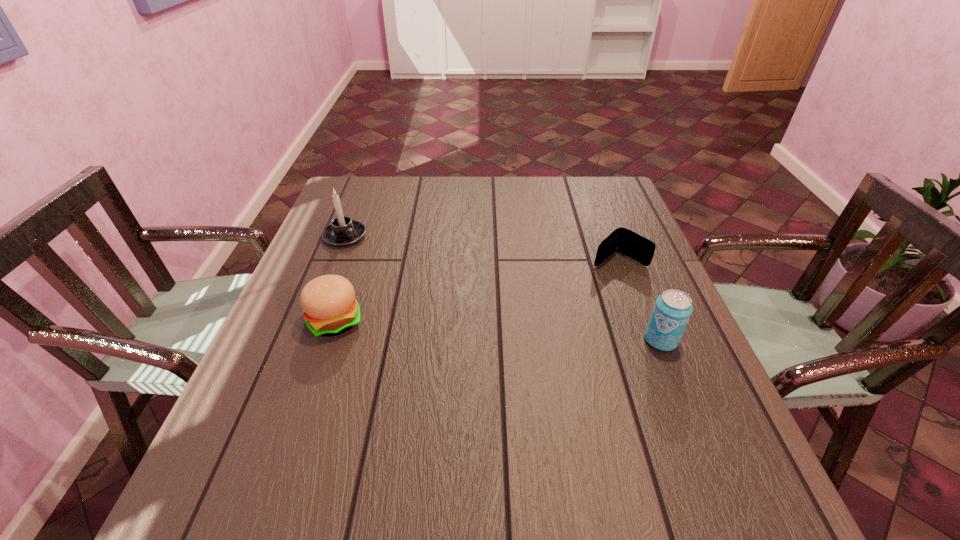
In order to click on unoccupied position between the hamburger and the beer can in this screenshot , I will do `click(498, 330)`.

Where is `free spot between the beer can and the candle holder`? The height and width of the screenshot is (540, 960). free spot between the beer can and the candle holder is located at coordinates (503, 288).

You are a GUI agent. You are given a task and a screenshot of the screen. Output one action in this format:
    pyautogui.click(x=<x>, y=<y>)
    Task: Click on the object that can be found as the third closest to the beer can
    
    Given the screenshot: What is the action you would take?
    pyautogui.click(x=343, y=231)

Identify which object is the third closest to the hamburger. Please provide its 2D coordinates. Your answer should be formatted as a tuple, i.e. [(x, y)], where the tuple contains the x and y coordinates of a point satisfying the conditions above.

[(672, 310)]

Where is `vacant position in the image that satisfies the following two spatial constraints: 1. on the front side of the farthest object; 2. on the left side of the third tallest object`? The width and height of the screenshot is (960, 540). vacant position in the image that satisfies the following two spatial constraints: 1. on the front side of the farthest object; 2. on the left side of the third tallest object is located at coordinates (312, 321).

Identify the location of free region that satisfies the following two spatial constraints: 1. on the front side of the shortest object; 2. on the right side of the beer can. (648, 340).

This screenshot has height=540, width=960. In order to click on free spot that satisfies the following two spatial constraints: 1. on the back side of the hamburger; 2. on the left side of the shortest object in this screenshot , I will do [x=356, y=260].

Image resolution: width=960 pixels, height=540 pixels. In order to click on blank space that satisfies the following two spatial constraints: 1. on the front side of the wallet; 2. on the right side of the tallest object in this screenshot , I will do `click(336, 260)`.